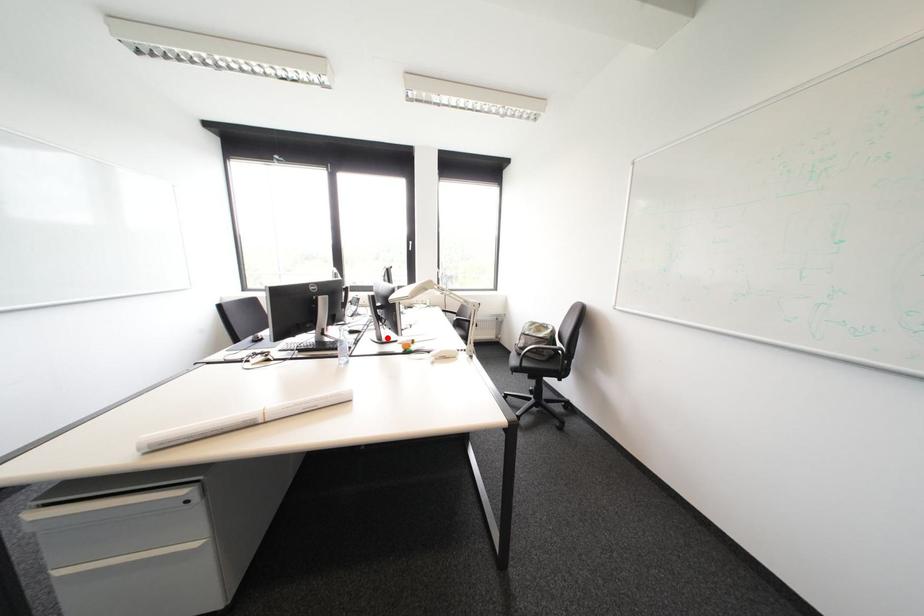
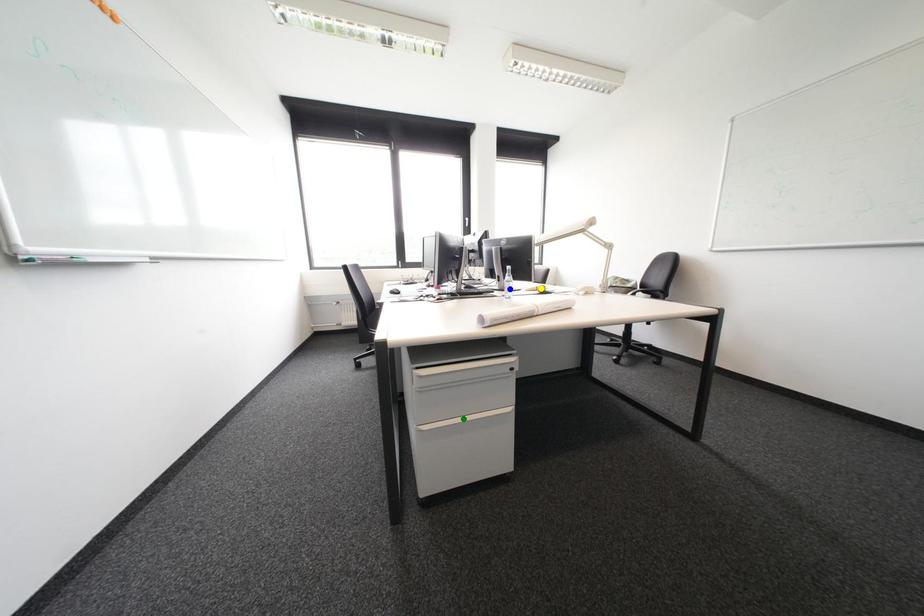
Question: I am providing you with two images of the same scene from different viewpoints. A red point is marked on the first image. You are given multiple points on the second image. Which mark in image 2 goes with the point in image 1?

Choices:
 (A) green point
 (B) blue point
 (C) yellow point

Answer: (B)